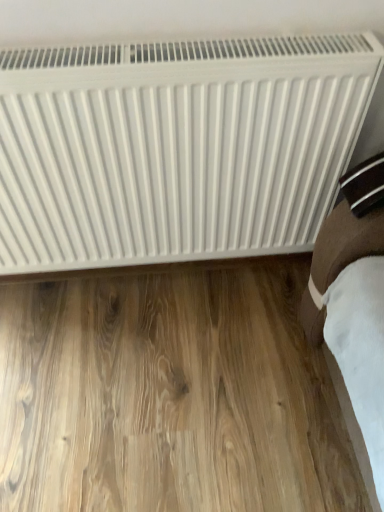
Question: Is white matte radiator at upper center at the back of light brown wood flooring at lower center?

Choices:
 (A) yes
 (B) no

Answer: (B)

Question: Is light brown wood flooring at lower center behind white matte radiator at upper center?

Choices:
 (A) yes
 (B) no

Answer: (A)

Question: Could you tell me if light brown wood flooring at lower center is turned towards white matte radiator at upper center?

Choices:
 (A) yes
 (B) no

Answer: (B)

Question: Is light brown wood flooring at lower center not within white matte radiator at upper center?

Choices:
 (A) yes
 (B) no

Answer: (A)

Question: Is light brown wood flooring at lower center at the left side of white matte radiator at upper center?

Choices:
 (A) yes
 (B) no

Answer: (A)

Question: Would you say white matte radiator at upper center is part of light brown wood flooring at lower center's contents?

Choices:
 (A) yes
 (B) no

Answer: (B)

Question: Is white matte radiator at upper center with light brown wood flooring at lower center?

Choices:
 (A) yes
 (B) no

Answer: (B)

Question: From the image's perspective, is white matte radiator at upper center beneath light brown wood flooring at lower center?

Choices:
 (A) no
 (B) yes

Answer: (A)

Question: Does white matte radiator at upper center appear on the right side of light brown wood flooring at lower center?

Choices:
 (A) yes
 (B) no

Answer: (A)

Question: Considering the relative sizes of white matte radiator at upper center and light brown wood flooring at lower center in the image provided, is white matte radiator at upper center smaller than light brown wood flooring at lower center?

Choices:
 (A) yes
 (B) no

Answer: (B)

Question: Is white matte radiator at upper center in front of light brown wood flooring at lower center?

Choices:
 (A) no
 (B) yes

Answer: (B)

Question: Is white matte radiator at upper center oriented away from light brown wood flooring at lower center?

Choices:
 (A) no
 (B) yes

Answer: (A)

Question: Looking at their shapes, would you say light brown wood flooring at lower center is wider or thinner than white matte radiator at upper center?

Choices:
 (A) wide
 (B) thin

Answer: (A)